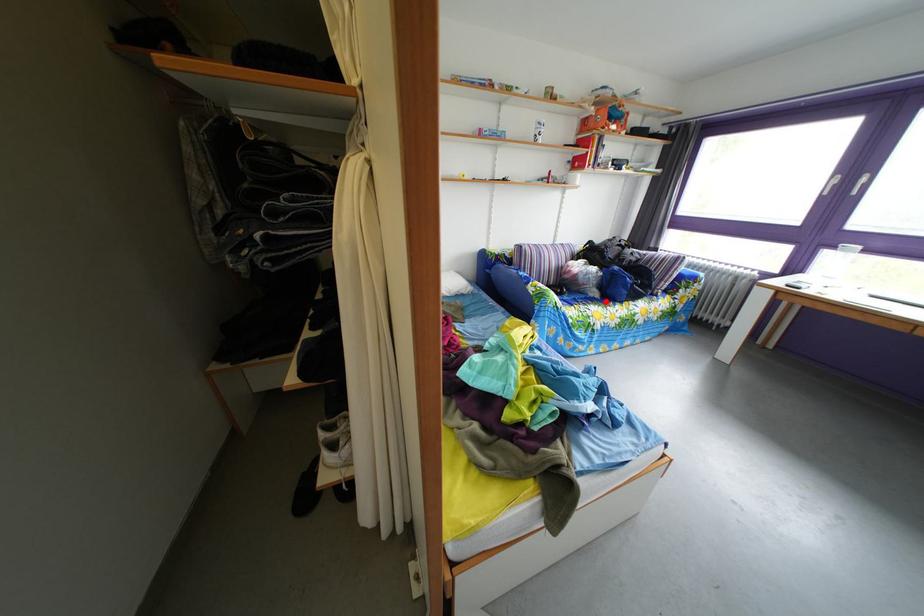
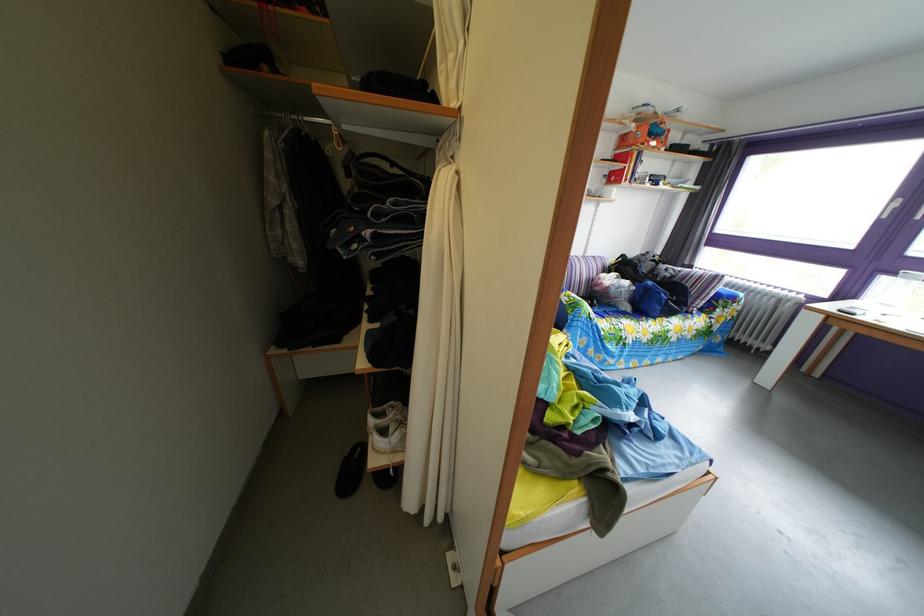
Find the pixel in the second image that matches the highlighted location in the first image.

(638, 315)